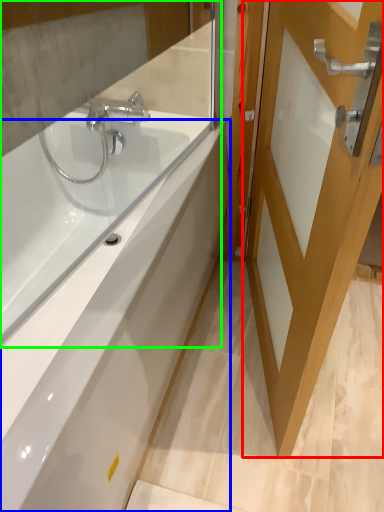
Question: Which object is positioned farthest from door (highlighted by a red box)? Select from bathtub (highlighted by a blue box) and mirror (highlighted by a green box).

Choices:
 (A) bathtub
 (B) mirror

Answer: (B)